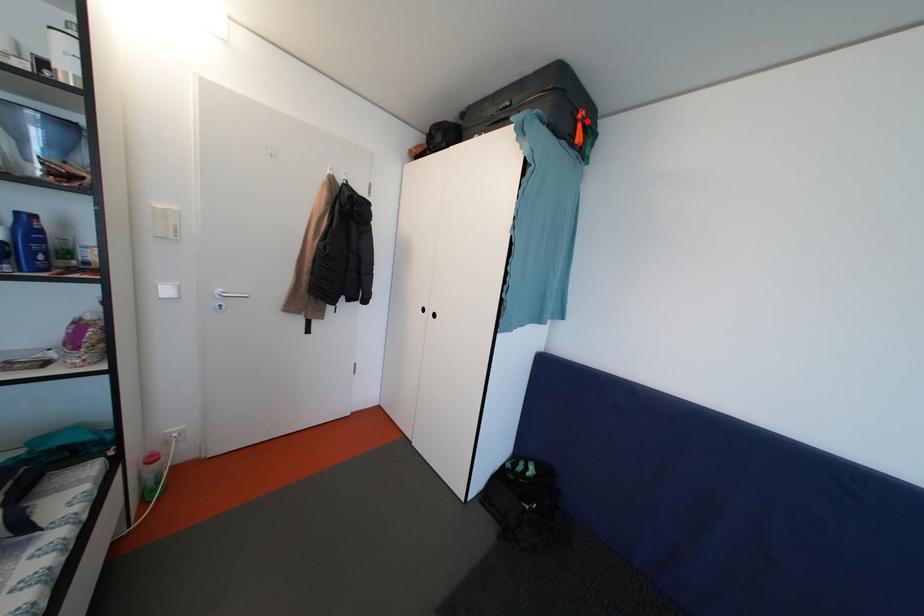
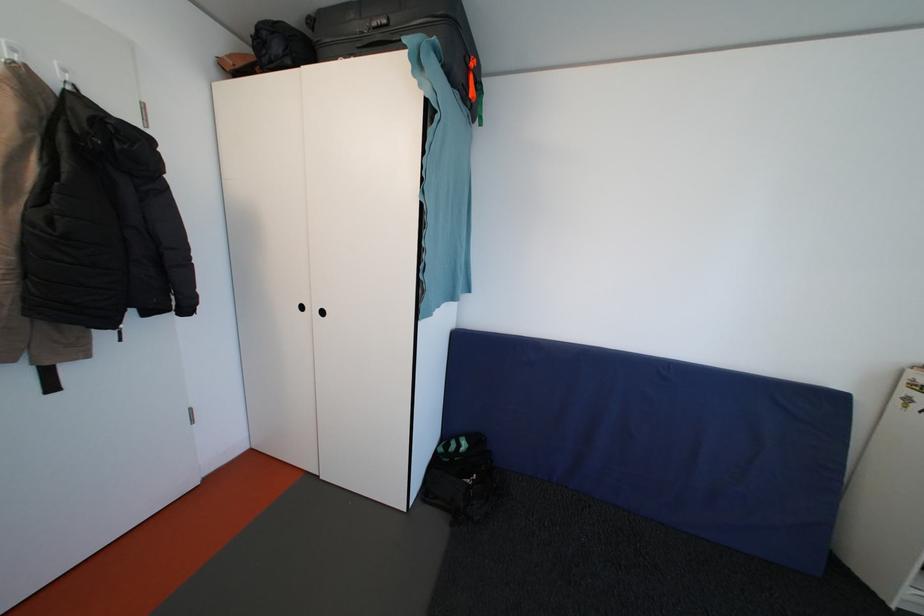
Question: I am providing you with two images of the same scene from different viewpoints. A red point is marked on the first image. Is the red point's position out of view in image 2?

Choices:
 (A) Yes
 (B) No

Answer: (B)